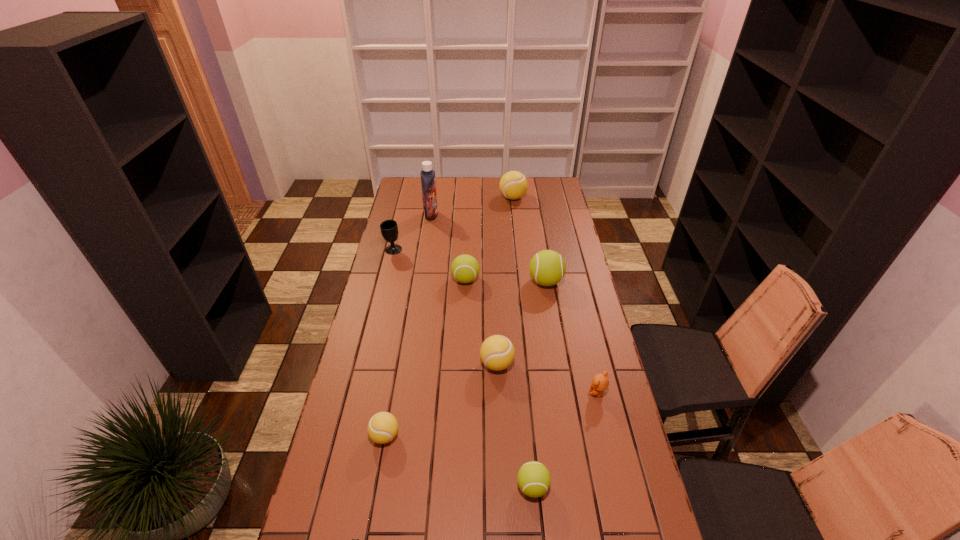
What are the coordinates of `empty space that is in between the second smallest green tennis ball and the biggest green tennis ball` in the screenshot? It's located at (506, 281).

This screenshot has height=540, width=960. Find the location of `object that is the seventh closest one to the biggest green tennis ball`. object that is the seventh closest one to the biggest green tennis ball is located at coordinates (382, 428).

Where is `the ninth closest object to the shampoo`? The image size is (960, 540). the ninth closest object to the shampoo is located at coordinates (352, 539).

Where is `tennis ball identified as the fifth closest to the fifth nearest object`? This screenshot has width=960, height=540. tennis ball identified as the fifth closest to the fifth nearest object is located at coordinates (513, 185).

Identify the location of tennis ball that can be found as the fifth closest to the blue shampoo. This screenshot has height=540, width=960. (382, 428).

This screenshot has height=540, width=960. What are the coordinates of `the second closest yellow tennis ball to the Bible` in the screenshot? It's located at (497, 352).

Locate which yellow tennis ball is the closest to the biggest green tennis ball. Please provide its 2D coordinates. Your answer should be formatted as a tuple, i.e. [(x, y)], where the tuple contains the x and y coordinates of a point satisfying the conditions above.

[(497, 352)]

Locate an element on the screen. The height and width of the screenshot is (540, 960). green tennis ball that is the second closest one to the chalice is located at coordinates (547, 267).

This screenshot has width=960, height=540. Find the location of `green tennis ball that is the second nearest to the leftmost yellow tennis ball`. green tennis ball that is the second nearest to the leftmost yellow tennis ball is located at coordinates (464, 268).

This screenshot has width=960, height=540. In order to click on free space that satisfies the following two spatial constraints: 1. on the front label of the fifth tennis ball from right to left; 2. on the left side of the tallest object in this screenshot , I will do `click(421, 280)`.